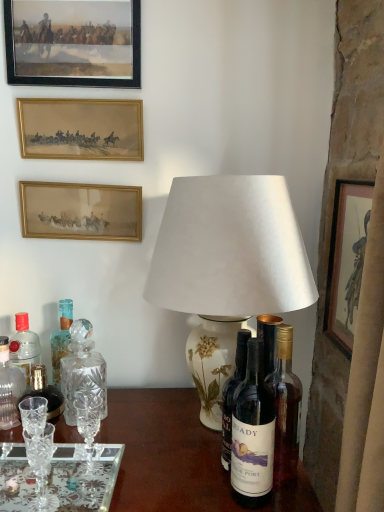
What is the approximate width of gold/glass picture frame at upper left, which ranks as the 3th picture frame in left-to-right order?

1.54 inches.

Where is `clear glass decanter at left, which is the first bottle in left-to-right order`? clear glass decanter at left, which is the first bottle in left-to-right order is located at coordinates (9, 388).

Image resolution: width=384 pixels, height=512 pixels. Describe the element at coordinates (9, 388) in the screenshot. I see `clear glass decanter at left, acting as the fourth bottle starting from the right` at that location.

The height and width of the screenshot is (512, 384). I want to click on gold-framed painting at upper left, the 2th picture frame in the left-to-right sequence, so click(x=80, y=211).

Considering their positions, is wooden frame at upper left, positioned as the 1th picture frame in left-to-right order, located in front of or behind gold-framed painting at upper left, the 2th picture frame in the left-to-right sequence?

Clearly, wooden frame at upper left, positioned as the 1th picture frame in left-to-right order, is in front of gold-framed painting at upper left, the 2th picture frame in the left-to-right sequence.

From a real-world perspective, is wooden frame at upper left, which is counted as the 1th picture frame, starting from the top, over gold-framed painting at upper left, acting as the 2th picture frame starting from the bottom?

Correct, in the physical world, wooden frame at upper left, which is counted as the 1th picture frame, starting from the top, is higher than gold-framed painting at upper left, acting as the 2th picture frame starting from the bottom.

Does wooden frame at upper left, which is counted as the 1th picture frame, starting from the top, have a smaller size compared to gold-framed painting at upper left, marked as the third picture frame in a right-to-left arrangement?

No, wooden frame at upper left, which is counted as the 1th picture frame, starting from the top, is not smaller than gold-framed painting at upper left, marked as the third picture frame in a right-to-left arrangement.

From their relative heights in the image, would you say wooden frame at upper left, the fourth picture frame when ordered from bottom to top, is taller or shorter than gold-framed painting at upper left, positioned as the third picture frame in top-to-bottom order?

Clearly, wooden frame at upper left, the fourth picture frame when ordered from bottom to top, is taller compared to gold-framed painting at upper left, positioned as the third picture frame in top-to-bottom order.

Between wooden framed print at right, acting as the 4th picture frame starting from the left, and white paper lampshade at center, which one is positioned in front?

Positioned in front is white paper lampshade at center.

From a real-world perspective, who is located lower, wooden framed print at right, which is the first picture frame in right-to-left order, or white paper lampshade at center?

From a 3D spatial view, white paper lampshade at center is below.

Is wooden framed print at right, marked as the 1th picture frame in a bottom-to-top arrangement, taller than white paper lampshade at center?

In fact, wooden framed print at right, marked as the 1th picture frame in a bottom-to-top arrangement, may be shorter than white paper lampshade at center.

From the image's perspective, relative to white paper lampshade at center, is wooden framed print at right, the fourth picture frame from the top, above or below?

Clearly, from the image's perspective, wooden framed print at right, the fourth picture frame from the top, is above white paper lampshade at center.

Is dark glass bottle at center, the 1th bottle positioned from the right, directly adjacent to white paper lampshade at center?

No, dark glass bottle at center, the 1th bottle positioned from the right, is not making contact with white paper lampshade at center.

Based on the photo, considering their positions, is dark glass bottle at center, placed as the 4th bottle when sorted from back to front, located in front of or behind white paper lampshade at center?

Clearly, dark glass bottle at center, placed as the 4th bottle when sorted from back to front, is in front of white paper lampshade at center.

From a real-world perspective, is dark glass bottle at center, placed as the 4th bottle when sorted from back to front, above or below white paper lampshade at center?

In terms of real-world spatial position, dark glass bottle at center, placed as the 4th bottle when sorted from back to front, is below white paper lampshade at center.

Does dark glass bottle at center, which ranks as the 1th bottle in front-to-back order, contain white paper lampshade at center?

Definitely not — white paper lampshade at center is not inside dark glass bottle at center, which ranks as the 1th bottle in front-to-back order.

Considering the relative sizes of wooden framed print at right, which is the first picture frame in right-to-left order, and gold-framed painting at upper left, positioned as the third picture frame in top-to-bottom order, in the image provided, is wooden framed print at right, which is the first picture frame in right-to-left order, bigger than gold-framed painting at upper left, positioned as the third picture frame in top-to-bottom order,?

Indeed, wooden framed print at right, which is the first picture frame in right-to-left order, has a larger size compared to gold-framed painting at upper left, positioned as the third picture frame in top-to-bottom order.

Is wooden framed print at right, the fourth picture frame from the top, not within gold-framed painting at upper left, marked as the third picture frame in a right-to-left arrangement?

Yes, wooden framed print at right, the fourth picture frame from the top, is not within gold-framed painting at upper left, marked as the third picture frame in a right-to-left arrangement.

In the image, is wooden framed print at right, marked as the 1th picture frame in a bottom-to-top arrangement, on the left side or the right side of gold-framed painting at upper left, acting as the 2th picture frame starting from the bottom?

Clearly, wooden framed print at right, marked as the 1th picture frame in a bottom-to-top arrangement, is on the right of gold-framed painting at upper left, acting as the 2th picture frame starting from the bottom, in the image.

From the picture: Visually, is dark glass bottle at center, which ranks as the 1th bottle in front-to-back order, positioned to the left or to the right of wooden framed print at right, the fourth picture frame from the top?

From the image, it's evident that dark glass bottle at center, which ranks as the 1th bottle in front-to-back order, is to the left of wooden framed print at right, the fourth picture frame from the top.

Considering the relative sizes of dark glass bottle at center, which ranks as the 1th bottle in front-to-back order, and wooden framed print at right, acting as the 4th picture frame starting from the left, in the image provided, is dark glass bottle at center, which ranks as the 1th bottle in front-to-back order, thinner than wooden framed print at right, acting as the 4th picture frame starting from the left,?

No, dark glass bottle at center, which ranks as the 1th bottle in front-to-back order, is not thinner than wooden framed print at right, acting as the 4th picture frame starting from the left.

How different are the orientations of dark glass bottle at center, the 4th bottle from the left, and wooden framed print at right, acting as the 4th picture frame starting from the left, in degrees?

dark glass bottle at center, the 4th bottle from the left, and wooden framed print at right, acting as the 4th picture frame starting from the left, are facing 73.6 degrees away from each other.

Is point (260, 355) behind point (336, 219)?

That is False.

Considering their positions, is gold-framed painting at upper left, the 2th picture frame in the left-to-right sequence, located in front of or behind clear glass decanter at left, which is the first bottle in left-to-right order?

Visually, gold-framed painting at upper left, the 2th picture frame in the left-to-right sequence, is located behind clear glass decanter at left, which is the first bottle in left-to-right order.

Can you see gold-framed painting at upper left, positioned as the third picture frame in top-to-bottom order, touching clear glass decanter at left, the third bottle in the front-to-back sequence?

No.

Considering the positions of points (25, 219) and (13, 405), is point (25, 219) closer to camera compared to point (13, 405)?

No, it is behind (13, 405).

At what (x,y) coordinates should I click in order to perform the action: click on the 2nd picture frame to the right when counting from the clear glass decanter at left, which is counted as the second bottle, starting from the back. Please return your answer as a coordinate pair (x, y). This screenshot has width=384, height=512. Looking at the image, I should click on (80, 211).

Looking at this image, considering the relative sizes of translucent glass bottle at left, the 4th bottle positioned from the front, and clear glass decanter at left, acting as the fourth bottle starting from the right, in the image provided, is translucent glass bottle at left, the 4th bottle positioned from the front, smaller than clear glass decanter at left, acting as the fourth bottle starting from the right,?

No.

Which object is wider, translucent glass bottle at left, the 2th bottle in the left-to-right sequence, or clear glass decanter at left, which is the first bottle in left-to-right order?

translucent glass bottle at left, the 2th bottle in the left-to-right sequence, is wider.

From a real-world perspective, is translucent glass bottle at left, which is the 1th bottle from back to front, on top of clear glass decanter at left, which is the first bottle in left-to-right order?

Yes, from a real-world perspective, translucent glass bottle at left, which is the 1th bottle from back to front, is over clear glass decanter at left, which is the first bottle in left-to-right order

What are the coordinates of `picture frame that appears on the left of gold-framed painting at upper left, acting as the 2th picture frame starting from the bottom` in the screenshot? It's located at (73, 42).

The width and height of the screenshot is (384, 512). In the image, there is a wooden framed print at right, acting as the 4th picture frame starting from the left. Identify the location of lamp below it (from the image's perspective). pyautogui.click(x=230, y=249).

When comparing their distances from clear glass decanter at lower left, the third bottle positioned from the left, does wooden framed print at right, marked as the 1th picture frame in a bottom-to-top arrangement, or dark glass bottle at center, placed as the 4th bottle when sorted from back to front, seem closer?

dark glass bottle at center, placed as the 4th bottle when sorted from back to front, lies closer to clear glass decanter at lower left, the third bottle positioned from the left, than the other object.

Looking at the image, which one is located further to gold/glass picture frame at upper left, placed as the 2th picture frame when sorted from right to left, white paper lampshade at center or wooden frame at upper left, positioned as the fourth picture frame in right-to-left order?

white paper lampshade at center.

In the scene shown: Which object lies nearer to the anchor point gold-framed painting at upper left, acting as the 2th picture frame starting from the bottom, wooden framed print at right, which is the first picture frame in right-to-left order, or wooden frame at upper left, the fourth picture frame when ordered from bottom to top?

Based on the image, wooden frame at upper left, the fourth picture frame when ordered from bottom to top, appears to be nearer to gold-framed painting at upper left, acting as the 2th picture frame starting from the bottom.

When comparing their distances from gold-framed painting at upper left, acting as the 2th picture frame starting from the bottom, does clear crystal glassware at lower left or dark glass bottle at center, placed as the 4th bottle when sorted from back to front, seem closer?

clear crystal glassware at lower left.

When comparing their distances from gold/glass picture frame at upper left, acting as the 3th picture frame starting from the bottom, does white paper lampshade at center or dark glass bottle at center, the 1th bottle positioned from the right, seem further?

dark glass bottle at center, the 1th bottle positioned from the right, lies further to gold/glass picture frame at upper left, acting as the 3th picture frame starting from the bottom, than the other object.

Considering their positions, is wooden framed print at right, acting as the 4th picture frame starting from the left, positioned closer to clear glass decanter at left, the third bottle in the front-to-back sequence, than clear crystal glassware at lower left?

clear crystal glassware at lower left lies closer to clear glass decanter at left, the third bottle in the front-to-back sequence, than the other object.

When comparing their distances from clear glass decanter at left, acting as the fourth bottle starting from the right, does translucent glass bottle at left, the 3th bottle in the right-to-left sequence, or clear crystal glassware at lower left seem further?

Among the two, clear crystal glassware at lower left is located further to clear glass decanter at left, acting as the fourth bottle starting from the right.

Estimate the real-world distances between objects in this image. Which object is further from wooden frame at upper left, which is counted as the 1th picture frame, starting from the top, clear crystal glassware at lower left or gold/glass picture frame at upper left, acting as the 3th picture frame starting from the bottom?

clear crystal glassware at lower left is positioned further to the anchor wooden frame at upper left, which is counted as the 1th picture frame, starting from the top.

At what (x,y) coordinates should I click in order to perform the action: click on lamp situated between clear crystal glassware at lower left and dark glass bottle at center, the 1th bottle positioned from the right, from left to right. Please return your answer as a coordinate pair (x, y). The image size is (384, 512). Looking at the image, I should click on 230,249.

Image resolution: width=384 pixels, height=512 pixels. What are the coordinates of `bottle between gold-framed painting at upper left, the 2th picture frame in the left-to-right sequence, and clear glass decanter at left, which is counted as the second bottle, starting from the back, vertically` in the screenshot? It's located at (24, 346).

Find the location of a particular element. The width and height of the screenshot is (384, 512). lamp between wooden frame at upper left, positioned as the 1th picture frame in left-to-right order, and clear glass decanter at lower left, arranged as the 2th bottle when viewed from the front, in the vertical direction is located at coordinates (230, 249).

Locate an element on the screen. lamp between dark glass bottle at center, which ranks as the 1th bottle in front-to-back order, and gold-framed painting at upper left, marked as the third picture frame in a right-to-left arrangement, along the z-axis is located at coordinates (230, 249).